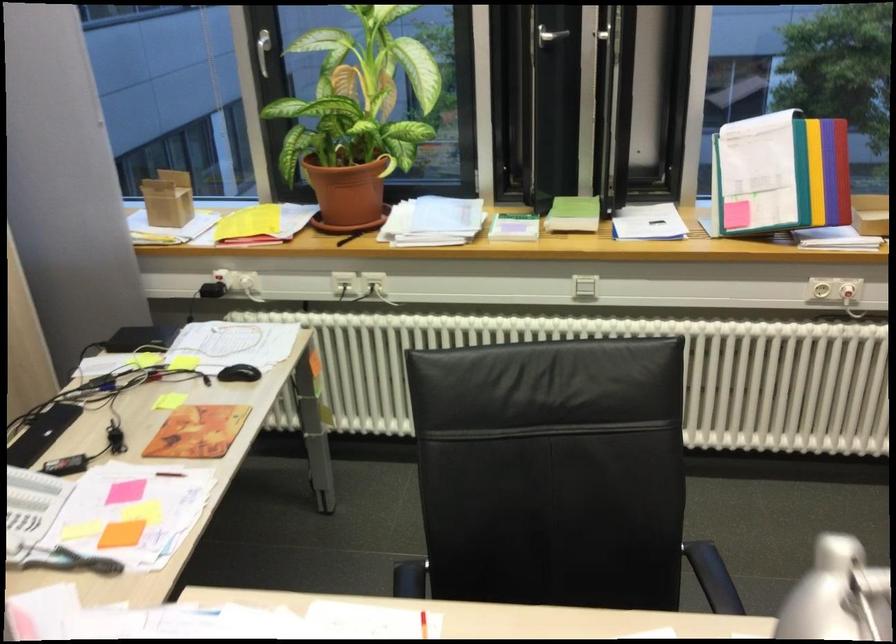
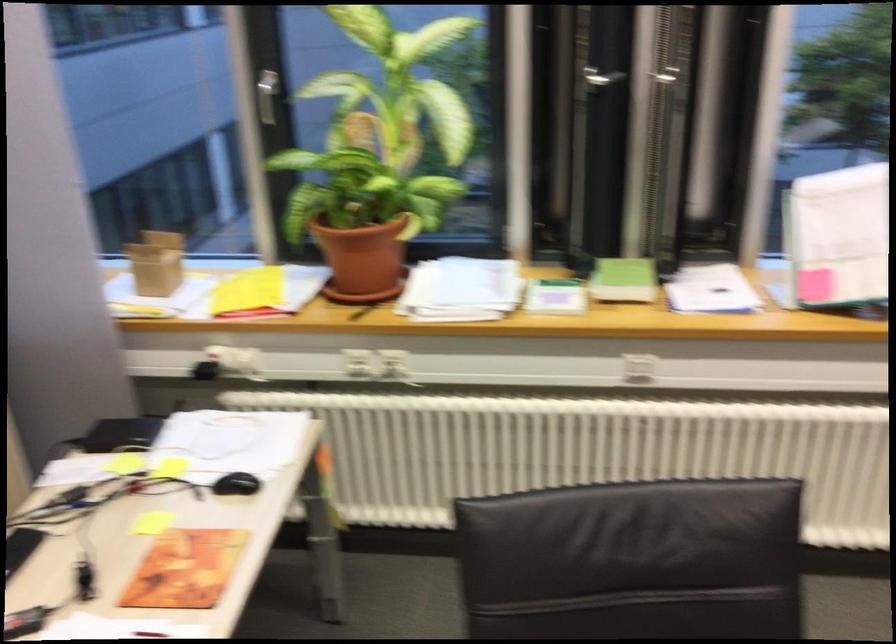
Question: In a continuous first-person perspective shot, in which direction is the camera moving?

Choices:
 (A) Left
 (B) Right
 (C) Forward
 (D) Backward

Answer: (C)